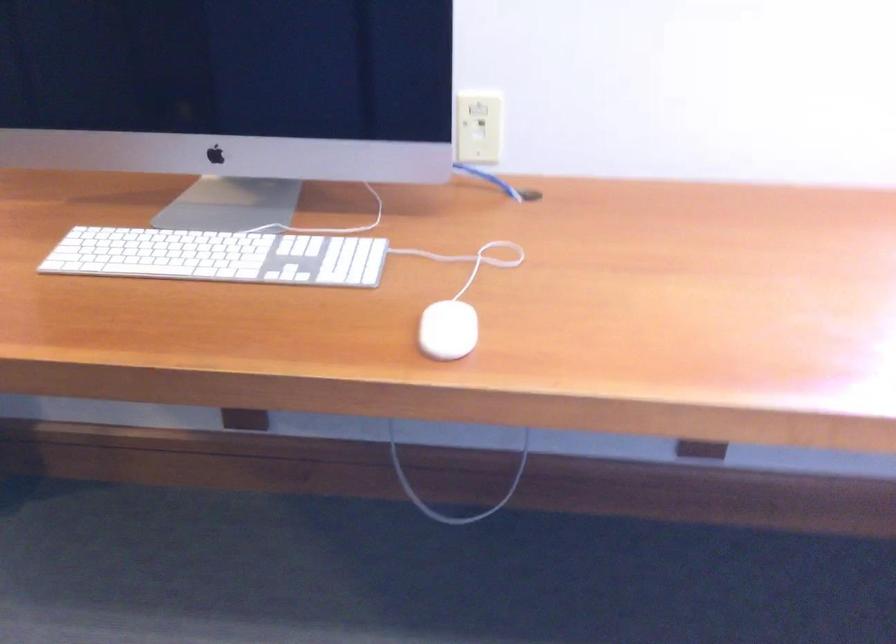
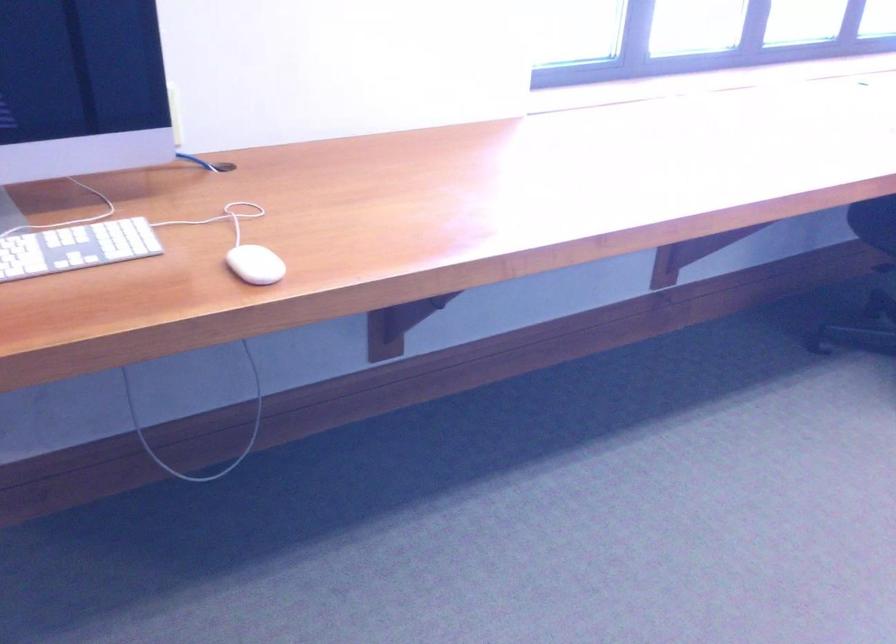
Locate, in the second image, the point that corresponds to point (291, 263) in the first image.

(75, 247)